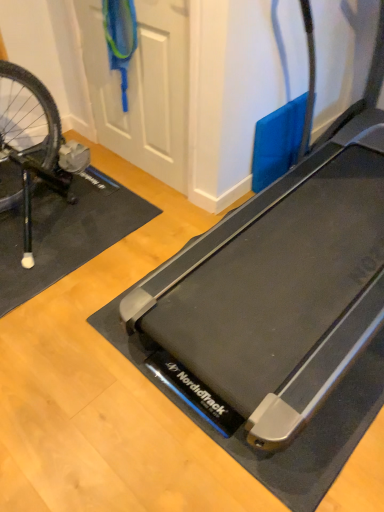
Question: Is black rubber yoga mat at left located outside white matte door at upper center?

Choices:
 (A) no
 (B) yes

Answer: (B)

Question: From a real-world perspective, is black rubber yoga mat at left positioned under white matte door at upper center based on gravity?

Choices:
 (A) no
 (B) yes

Answer: (B)

Question: Is white matte door at upper center completely or partially inside black rubber yoga mat at left?

Choices:
 (A) no
 (B) yes

Answer: (A)

Question: Can you confirm if black rubber yoga mat at left is taller than white matte door at upper center?

Choices:
 (A) yes
 (B) no

Answer: (B)

Question: From the image's perspective, is black rubber yoga mat at left on white matte door at upper center?

Choices:
 (A) yes
 (B) no

Answer: (B)

Question: Looking at the image, does white matte door at upper center seem bigger or smaller compared to black rubber treadmill at center?

Choices:
 (A) small
 (B) big

Answer: (A)

Question: Considering the positions of point (109, 93) and point (241, 309), is point (109, 93) closer or farther from the camera than point (241, 309)?

Choices:
 (A) closer
 (B) farther

Answer: (B)

Question: In the image, is white matte door at upper center on the left side or the right side of black rubber treadmill at center?

Choices:
 (A) right
 (B) left

Answer: (B)

Question: Is white matte door at upper center in front of or behind black rubber treadmill at center in the image?

Choices:
 (A) front
 (B) behind

Answer: (B)

Question: From the image's perspective, is black rubber yoga mat at left positioned above or below white matte door at upper center?

Choices:
 (A) below
 (B) above

Answer: (A)

Question: From a real-world perspective, is black rubber yoga mat at left positioned above or below white matte door at upper center?

Choices:
 (A) above
 (B) below

Answer: (B)

Question: Relative to white matte door at upper center, is black rubber yoga mat at left in front or behind?

Choices:
 (A) front
 (B) behind

Answer: (B)

Question: Would you say black rubber yoga mat at left is inside or outside white matte door at upper center?

Choices:
 (A) inside
 (B) outside

Answer: (B)

Question: From the image's perspective, is black rubber treadmill at center located above or below black rubber yoga mat at left?

Choices:
 (A) above
 (B) below

Answer: (A)

Question: In terms of width, does black rubber treadmill at center look wider or thinner when compared to black rubber yoga mat at left?

Choices:
 (A) thin
 (B) wide

Answer: (B)